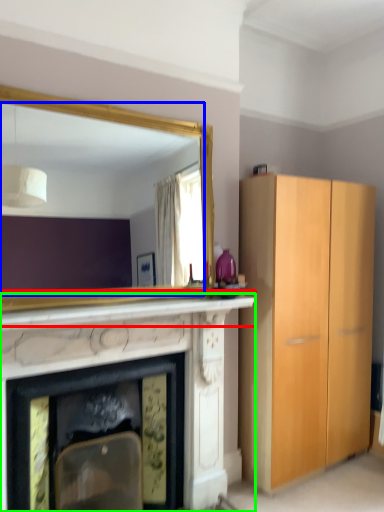
Question: Which object is the closest to the mantle (highlighted by a red box)? Choose among these: mirror (highlighted by a blue box) or fireplace (highlighted by a green box).

Choices:
 (A) mirror
 (B) fireplace

Answer: (B)